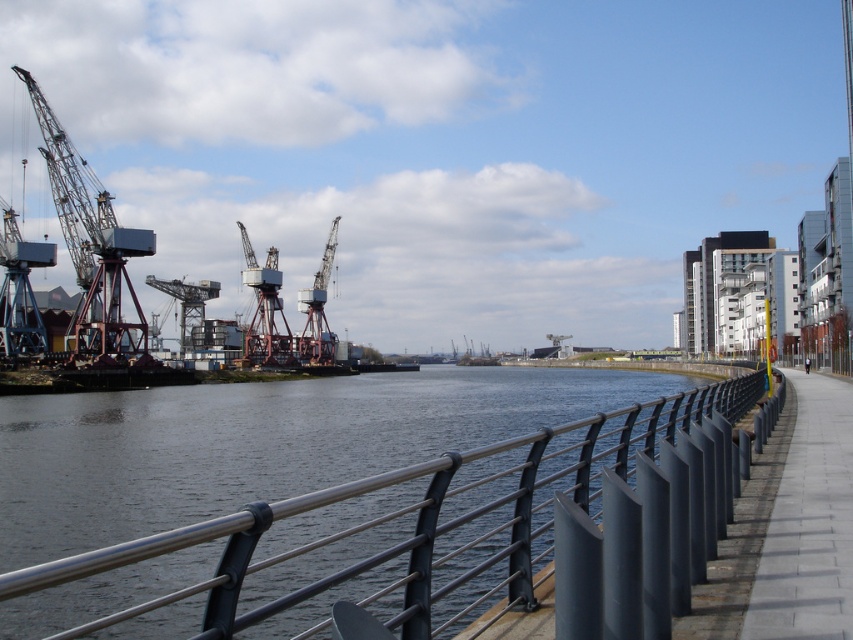
Question: Which point appears closest to the camera in this image?

Choices:
 (A) (834, 545)
 (B) (107, 225)

Answer: (A)

Question: Is metallic industrial crane at left above metallic industrial crane at center?

Choices:
 (A) no
 (B) yes

Answer: (B)

Question: Is gray concrete sidewalk at right below metallic industrial crane at center?

Choices:
 (A) yes
 (B) no

Answer: (A)

Question: Does dark gray water at center have a lesser width compared to gray concrete sidewalk at right?

Choices:
 (A) no
 (B) yes

Answer: (A)

Question: Which is farther from the metallic industrial crane at left?

Choices:
 (A) dark gray water at center
 (B) gray concrete sidewalk at right

Answer: (B)

Question: Which of the following is the farthest from the observer?

Choices:
 (A) (206, 284)
 (B) (350, 417)

Answer: (A)